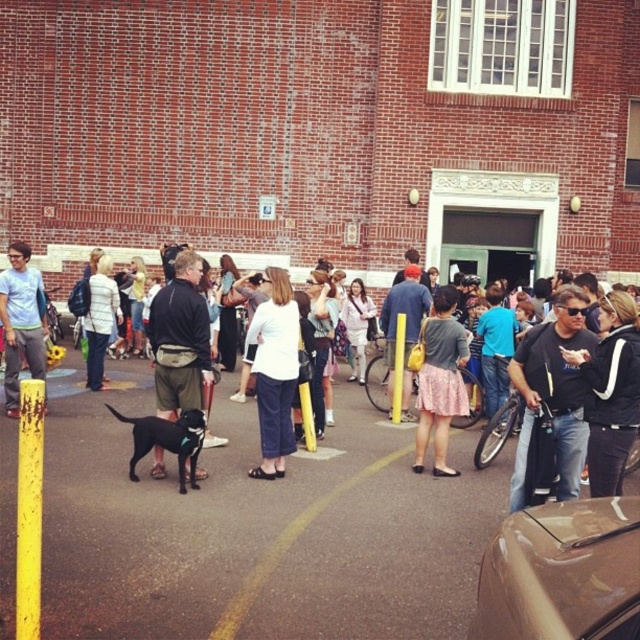
Does black matte shirt at center-right have a smaller size compared to matte gray sweater at center?

Yes.

The width and height of the screenshot is (640, 640). Identify the location of black matte shirt at center-right. (554, 392).

Identify the location of black matte shirt at center-right. The height and width of the screenshot is (640, 640). (554, 392).

Can you confirm if white matte pants at center is positioned to the right of matte gray sweater at center?

Incorrect, white matte pants at center is not on the right side of matte gray sweater at center.

Which is more to the right, white matte pants at center or matte gray sweater at center?

Positioned to the right is matte gray sweater at center.

At what (x,y) coordinates should I click in order to perform the action: click on white matte pants at center. Please return your answer as a coordinate pair (x, y). Looking at the image, I should click on (275, 371).

Does dark brown leather jacket at center have a larger size compared to white cotton shirt at center?

No.

Which of these two, dark brown leather jacket at center or white cotton shirt at center, stands shorter?

dark brown leather jacket at center is shorter.

The image size is (640, 640). What are the coordinates of `dark brown leather jacket at center` in the screenshot? It's located at (179, 339).